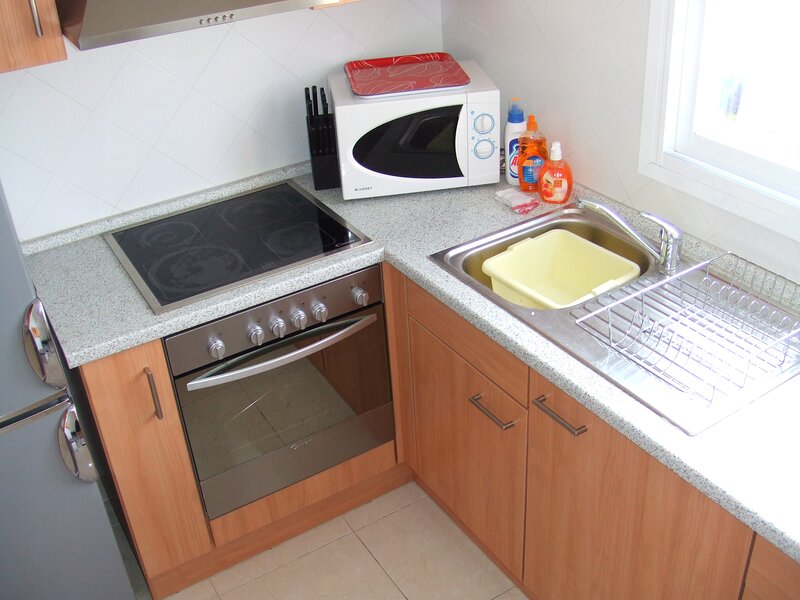
This screenshot has height=600, width=800. In order to click on cabinet door 1 in this screenshot , I will do `click(166, 466)`.